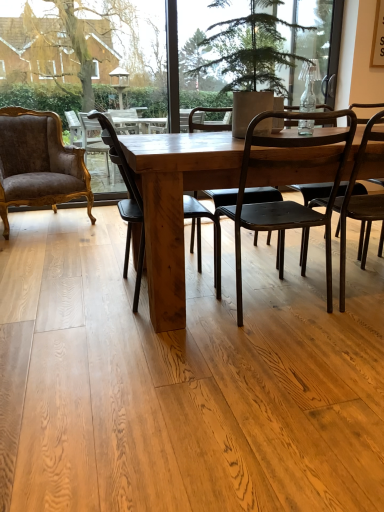
Identify the location of vacant space situated on the left part of wooden chair at center, positioned as the third chair in right-to-left order. (55, 300).